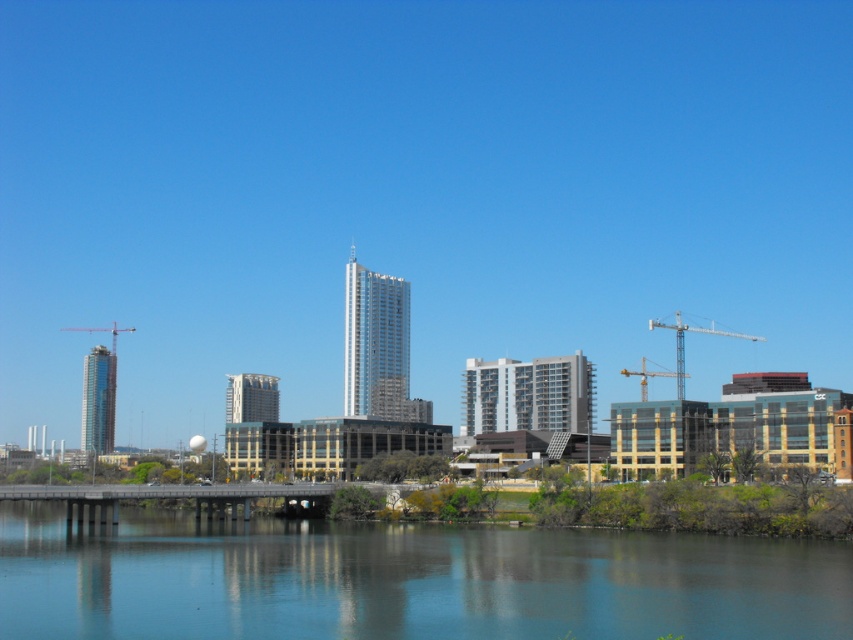
You are standing on the bridge in the cityscape image. You see a point marked at coordinates (683, 342). What object is located at that point?

The point at coordinates (683, 342) indicates a metallic gray crane at right.

What is the exact coordinate of the transparent glass water at center?

The transparent glass water at center is located at point (407, 580).